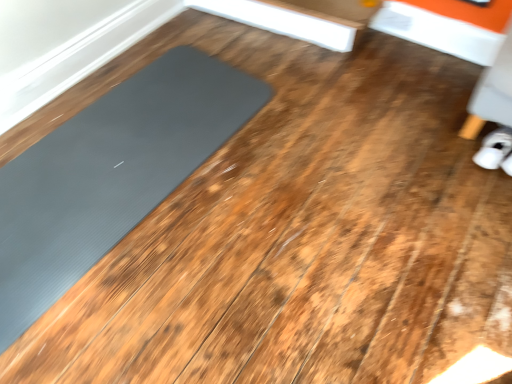
Locate an element on the screen. This screenshot has width=512, height=384. free spot to the right of gray rubber mat at left is located at coordinates click(324, 219).